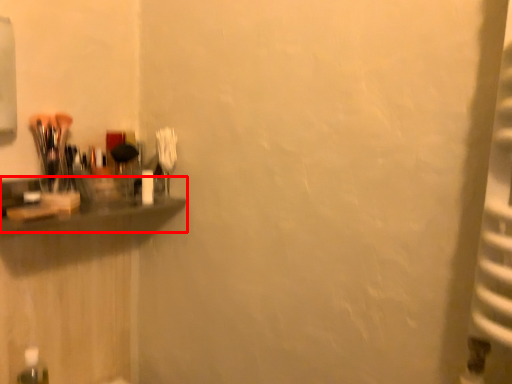
Question: From the image's perspective, what is the correct spatial relationship of shelf (annotated by the red box) in relation to bottle?

Choices:
 (A) below
 (B) above

Answer: (B)